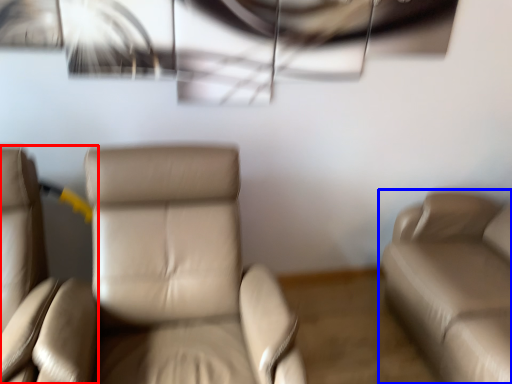
Question: Which of the following is the farthest to the observer, chair (highlighted by a red box) or studio couch (highlighted by a blue box)?

Choices:
 (A) chair
 (B) studio couch

Answer: (B)